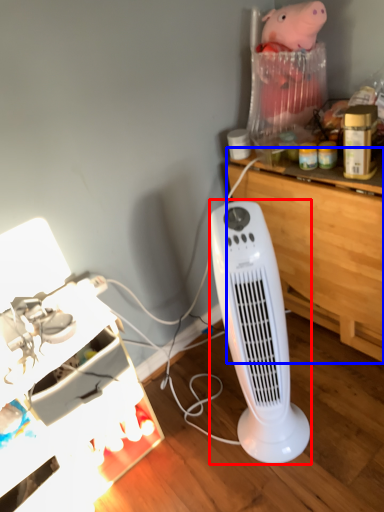
Question: Among these objects, which one is nearest to the camera, home appliance (highlighted by a red box) or computer desk (highlighted by a blue box)?

Choices:
 (A) home appliance
 (B) computer desk

Answer: (A)